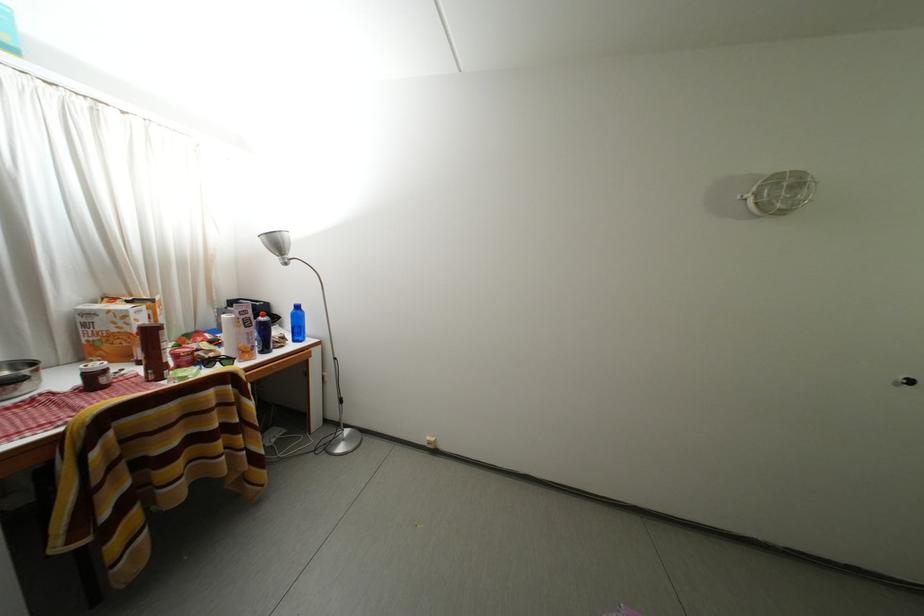
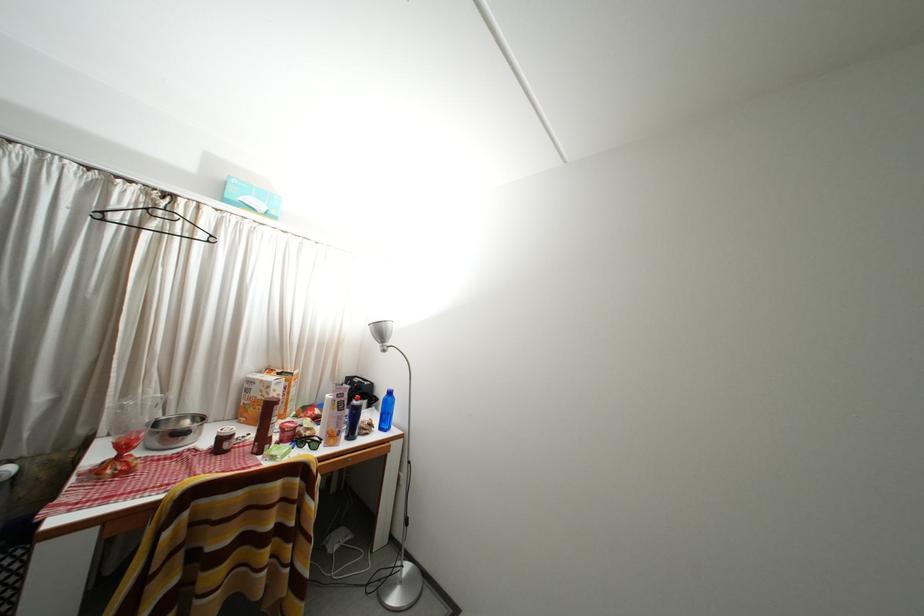
The point at (285, 249) is marked in the first image. Where is the corresponding point in the second image?

(388, 338)